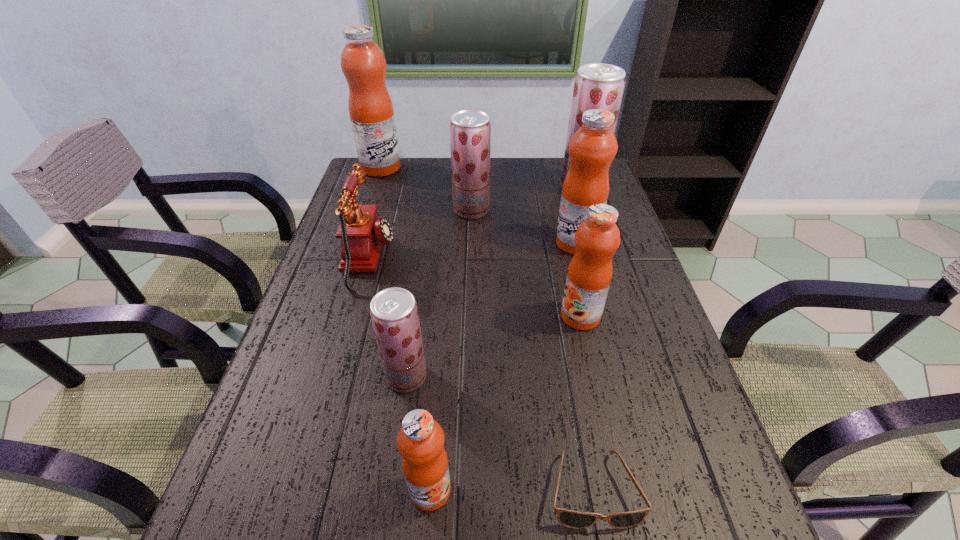
You are a GUI agent. You are given a task and a screenshot of the screen. Output one action in this format:
    pyautogui.click(x=<x>, y=<y>)
    Task: Click on the farthest orange fruit juice
    The height and width of the screenshot is (540, 960).
    Given the screenshot: What is the action you would take?
    pyautogui.click(x=363, y=64)

Locate an element on the screen. The width and height of the screenshot is (960, 540). the tallest object is located at coordinates (363, 64).

Locate an element on the screen. The image size is (960, 540). the farthest strawberry fruit juice is located at coordinates (597, 85).

Locate an element on the screen. This screenshot has width=960, height=540. the biggest strawberry fruit juice is located at coordinates (597, 85).

Where is `the third nearest orange fruit juice`? The image size is (960, 540). the third nearest orange fruit juice is located at coordinates (593, 147).

Find the location of a particular element. The image size is (960, 540). the fourth farthest fruit juice is located at coordinates (593, 147).

Find the location of a particular element. This screenshot has width=960, height=540. the second strawberry fruit juice from right to left is located at coordinates (470, 130).

Find the location of a particular element. Image resolution: width=960 pixels, height=540 pixels. the second farthest strawberry fruit juice is located at coordinates (470, 130).

At what (x,y) coordinates should I click in order to perform the action: click on the fourth nearest object. Please return your answer as a coordinate pair (x, y). Looking at the image, I should click on (597, 238).

Identify the location of the second nearest orange fruit juice. The width and height of the screenshot is (960, 540). (597, 238).